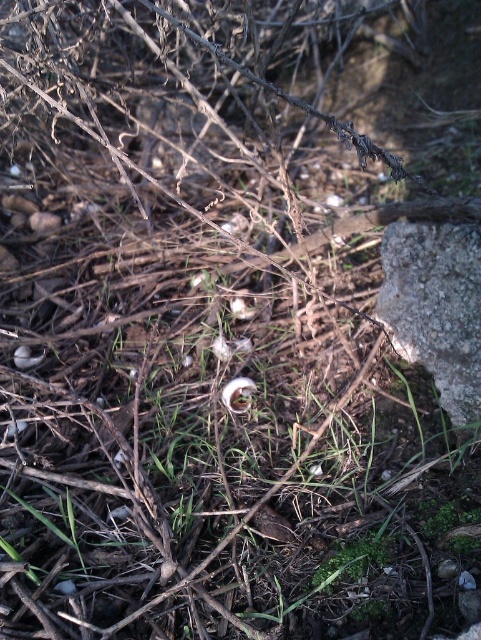
Can you confirm if gray rough stone at right is shorter than white matte flower at center?

No.

Measure the distance between gray rough stone at right and camera.

gray rough stone at right and camera are 4.79 feet apart from each other.

This screenshot has width=481, height=640. Find the location of `gray rough stone at right`. gray rough stone at right is located at coordinates (435, 307).